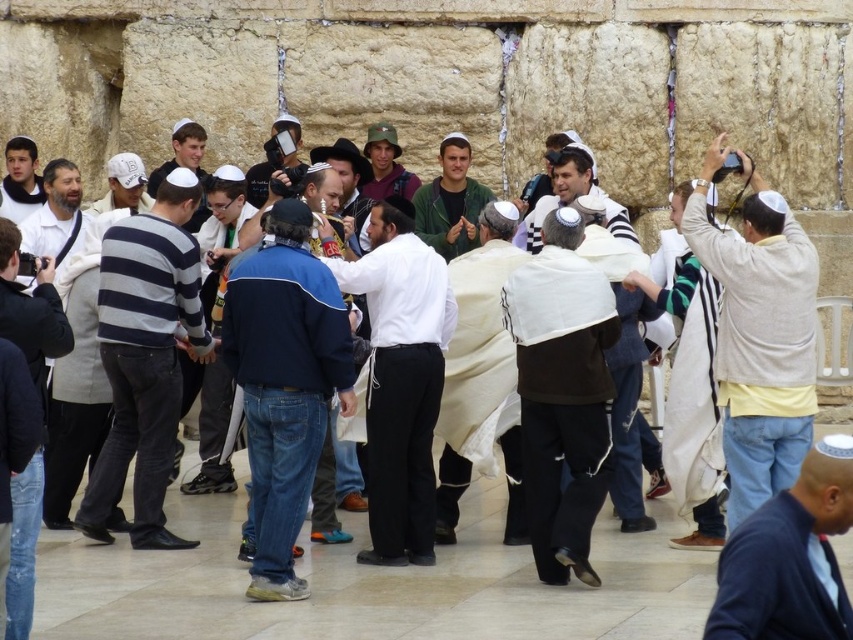
Who is taller, blue fleece jacket at center or white matte baseball cap at upper left?

With more height is blue fleece jacket at center.

Measure the distance between blue fleece jacket at center and white matte baseball cap at upper left.

blue fleece jacket at center and white matte baseball cap at upper left are 19.02 meters apart from each other.

Measure the distance between blue fleece jacket at center and camera.

They are 50.53 meters apart.

The height and width of the screenshot is (640, 853). Find the location of `blue fleece jacket at center`. blue fleece jacket at center is located at coordinates (283, 384).

Can you confirm if blue fleece jacket at center is positioned to the left of matte green sweater at center?

Result: Yes, blue fleece jacket at center is to the left of matte green sweater at center.

Between blue fleece jacket at center and matte green sweater at center, which one appears on the left side from the viewer's perspective?

Positioned to the left is blue fleece jacket at center.

Locate an element on the screen. Image resolution: width=853 pixels, height=640 pixels. blue fleece jacket at center is located at coordinates (283, 384).

Does light beige sweater at right have a greater height compared to blue fleece jacket at center?

Yes, light beige sweater at right is taller than blue fleece jacket at center.

Does light beige sweater at right appear on the right side of blue fleece jacket at center?

Indeed, light beige sweater at right is positioned on the right side of blue fleece jacket at center.

The image size is (853, 640). What do you see at coordinates (759, 333) in the screenshot?
I see `light beige sweater at right` at bounding box center [759, 333].

Where is `light beige sweater at right`? light beige sweater at right is located at coordinates tap(759, 333).